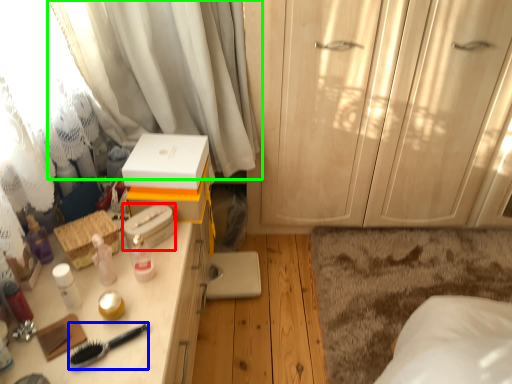
Question: Estimate the real-world distances between objects in this image. Which object is farther from storage box (highlighted by a red box), brush (highlighted by a blue box) or curtain (highlighted by a green box)?

Choices:
 (A) brush
 (B) curtain

Answer: (B)